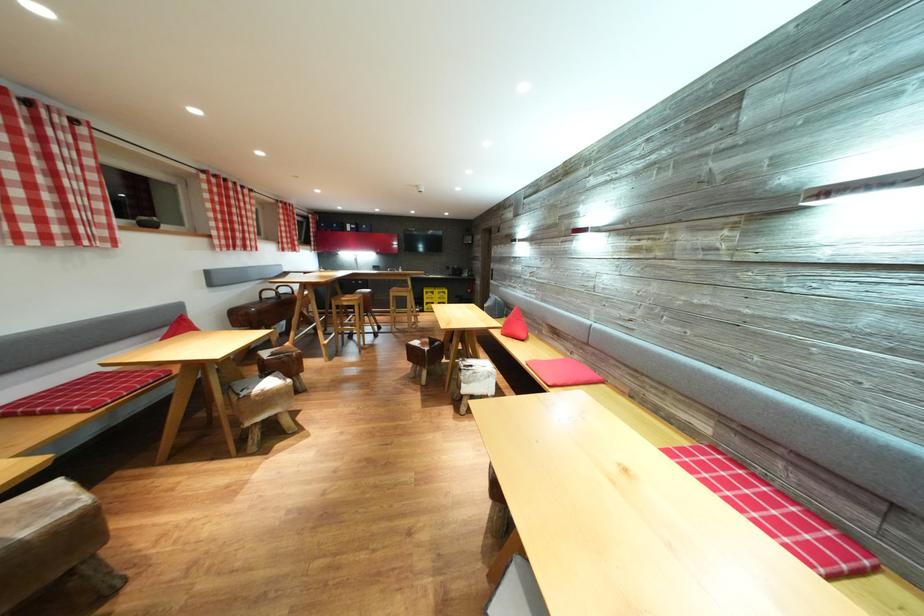
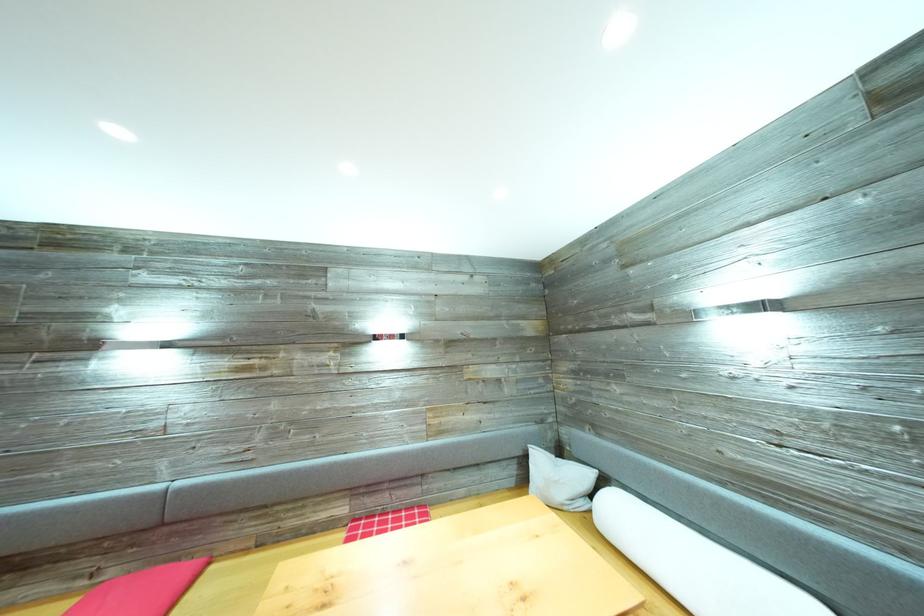
Question: I am providing you with two images of the same scene from different viewpoints. After the viewpoint changes to image2, which objects are now occluded?

Choices:
 (A) white cylindrical pillow
 (B) light grey pillow
 (C) red cushion
 (D) none of these

Answer: (D)